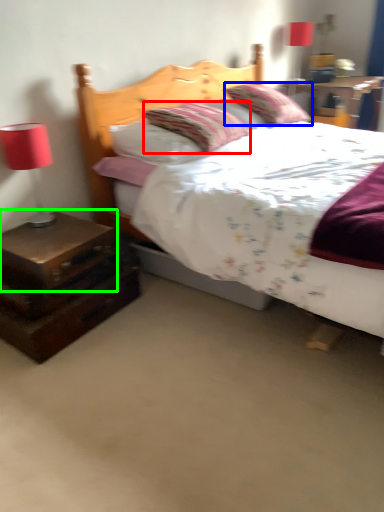
Question: Considering the real-world distances, which object is farthest from pillow (highlighted by a red box)? pillow (highlighted by a blue box) or nightstand (highlighted by a green box)?

Choices:
 (A) pillow
 (B) nightstand

Answer: (B)